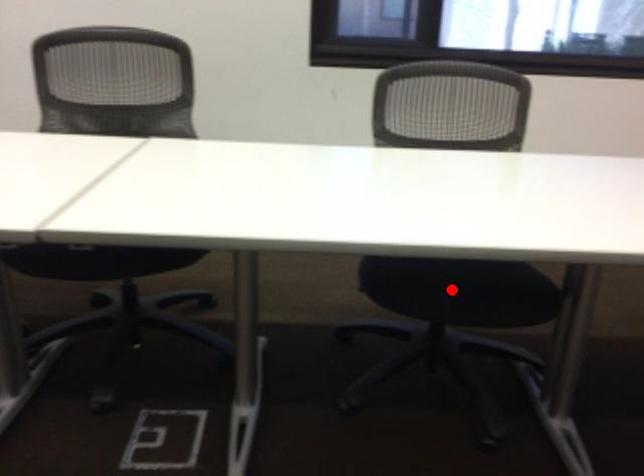
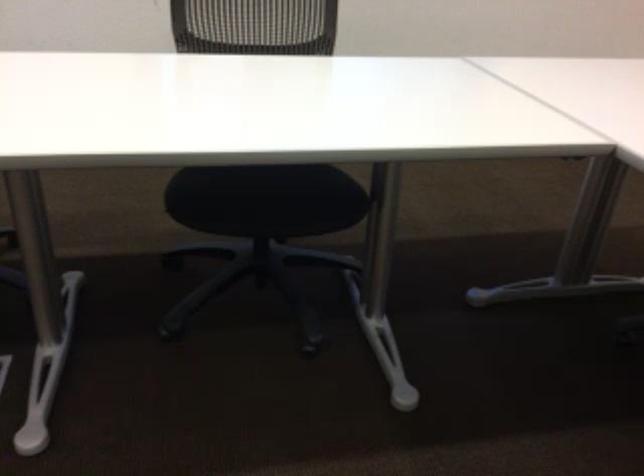
Find the pixel in the second image that matches the highlighted location in the first image.

(266, 199)